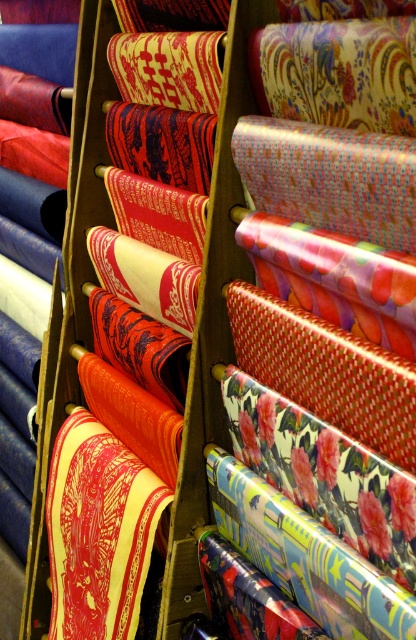
The width and height of the screenshot is (416, 640). What are the coordinates of `yellowmattefabric at center` in the screenshot? It's located at (99, 531).

Between yellowmattefabric at center and shiny red fabric at center, which one is positioned lower?

Positioned lower is yellowmattefabric at center.

Describe the element at coordinates (99, 531) in the screenshot. I see `yellowmattefabric at center` at that location.

Find the location of a particular element. yellowmattefabric at center is located at coordinates (99, 531).